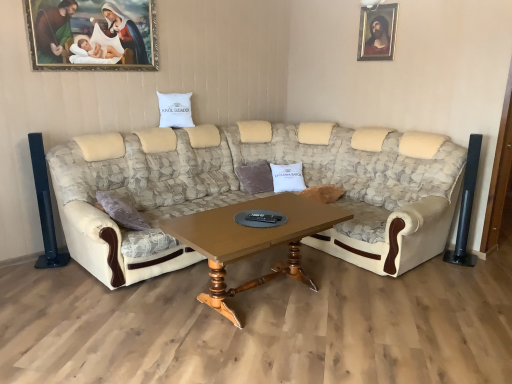
Question: Is point (404, 175) closer or farther from the camera than point (73, 6)?

Choices:
 (A) farther
 (B) closer

Answer: (A)

Question: Relative to wooden framed painting at upper left, the second picture frame when ordered from right to left, is beige fabric couch at center in front or behind?

Choices:
 (A) behind
 (B) front

Answer: (B)

Question: Which of these objects is positioned farthest from the white soft pillow at center?

Choices:
 (A) wooden framed portrait at upper right, the 2th picture frame viewed from the front
 (B) wooden framed painting at upper left, the 1th picture frame when ordered from left to right
 (C) wooden polished table at center
 (D) beige fabric couch at center

Answer: (B)

Question: Which object is positioned closest to the beige fabric couch at center?

Choices:
 (A) wooden framed portrait at upper right, which appears as the first picture frame when viewed from the right
 (B) wooden polished table at center
 (C) white soft pillow at center
 (D) wooden framed painting at upper left, which is the 2th picture frame in back-to-front order

Answer: (B)